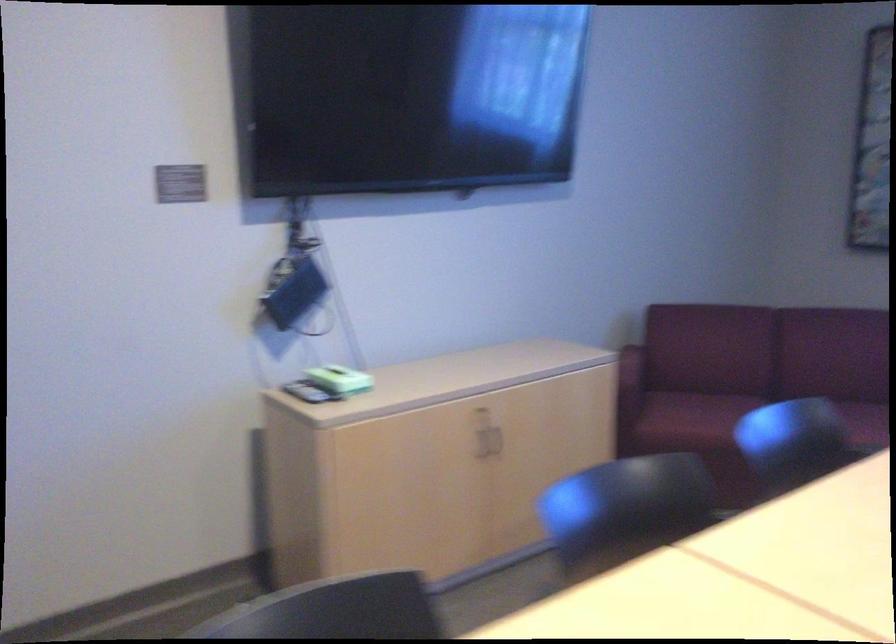
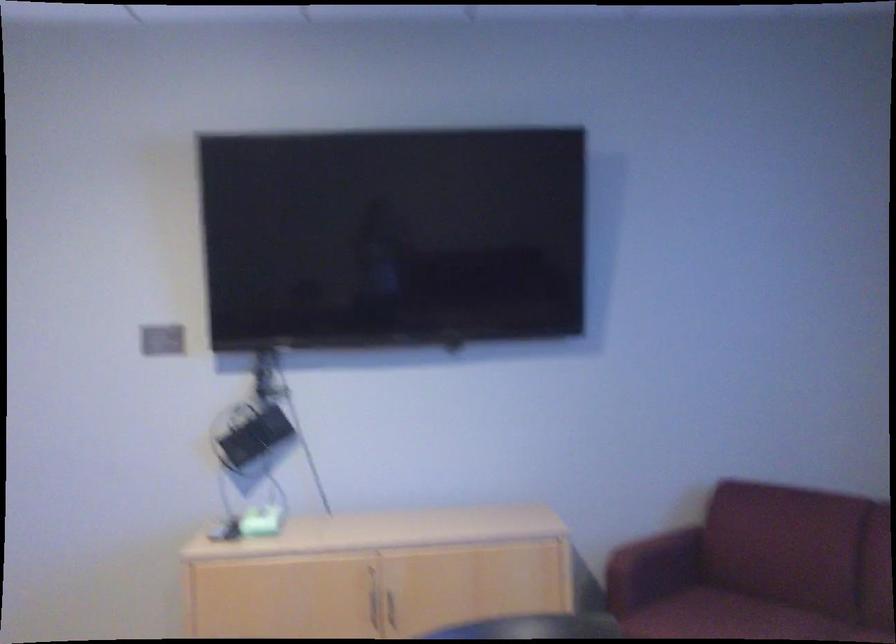
Find the pixel in the second image that matches pixel 484 440 in the first image.

(374, 607)